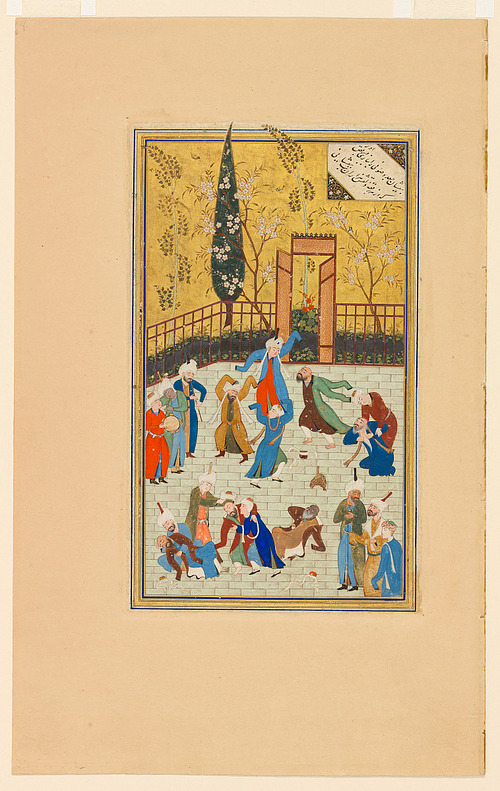
This screenshot has height=791, width=500. I want to click on light tan border, so click(x=358, y=2).